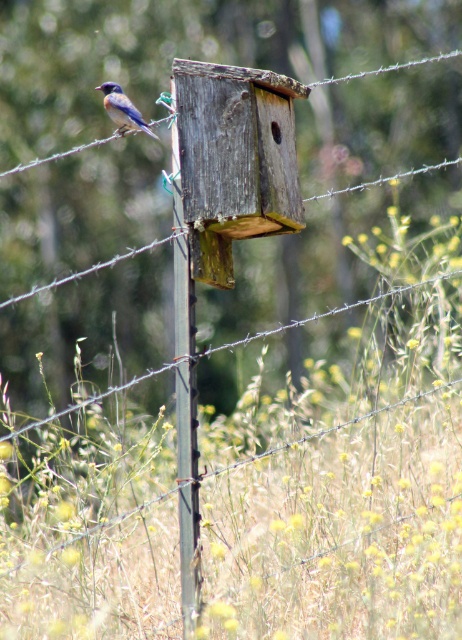
Is point (216, 168) closer to camera compared to point (115, 100)?

Yes, it is in front of point (115, 100).

Does weathered wood bird feeder at center have a greater width compared to blue glossy bird at upper left?

Yes.

Does point (180, 125) lie behind point (132, 122)?

No.

The height and width of the screenshot is (640, 462). What are the coordinates of `weathered wood bird feeder at center` in the screenshot? It's located at (235, 160).